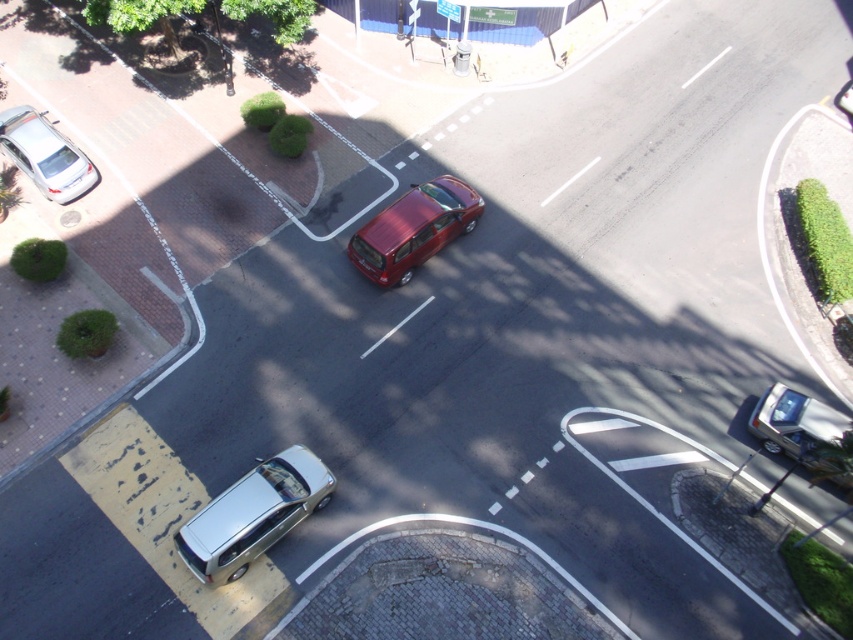
Does shiny red car at center lie behind metallic silver car at lower right?

Yes, shiny red car at center is behind metallic silver car at lower right.

Does shiny red car at center appear on the right side of metallic silver car at lower right?

No, shiny red car at center is not to the right of metallic silver car at lower right.

Is point (437, 209) in front of point (757, 420)?

No.

Identify the location of shiny red car at center. (413, 228).

Who is more distant from viewer, (35, 173) or (798, 417)?

Positioned behind is point (35, 173).

Who is more forward, (61, 148) or (773, 422)?

Point (773, 422)

Locate an element on the screen. This screenshot has height=640, width=853. silver metallic sedan at left is located at coordinates (45, 154).

Can you confirm if silver metallic van at lower left is thinner than silver metallic sedan at left?

Incorrect, silver metallic van at lower left's width is not less than silver metallic sedan at left's.

Who is lower down, silver metallic van at lower left or silver metallic sedan at left?

Positioned lower is silver metallic van at lower left.

Is point (244, 518) more distant than point (61, 177)?

No, it is in front of (61, 177).

I want to click on silver metallic van at lower left, so click(x=253, y=515).